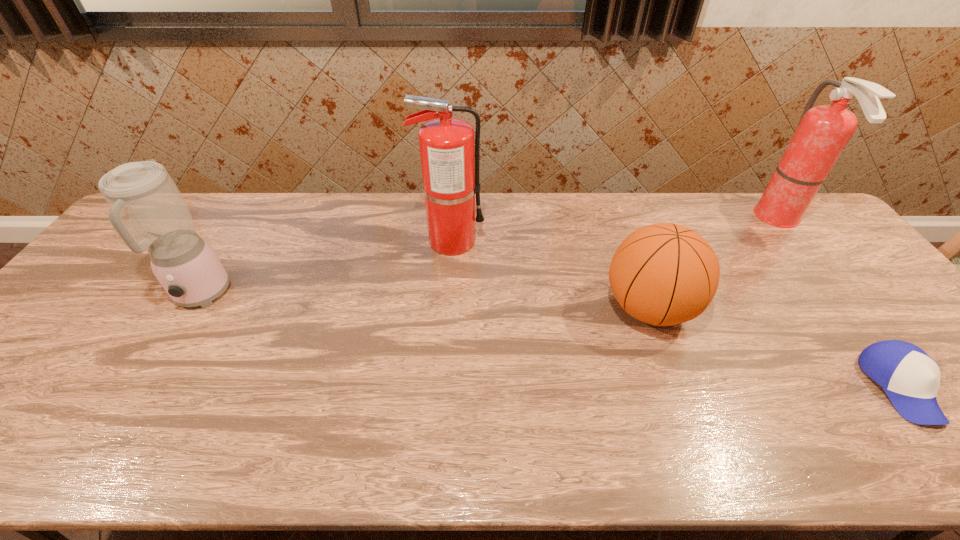
The height and width of the screenshot is (540, 960). What are the coordinates of `the second object from left to right` in the screenshot? It's located at click(450, 164).

You are a GUI agent. You are given a task and a screenshot of the screen. Output one action in this format:
    pyautogui.click(x=<x>, y=<y>)
    Task: Click on the right fire extinguisher
    
    Given the screenshot: What is the action you would take?
    click(x=823, y=132)

Locate an element on the screen. the leftmost object is located at coordinates (147, 210).

The height and width of the screenshot is (540, 960). Find the location of `food processor`. food processor is located at coordinates tap(147, 210).

Identify the location of the third object from right to left. The width and height of the screenshot is (960, 540). (664, 274).

What are the coordinates of `basketball` in the screenshot? It's located at (664, 274).

In order to click on free space located at the nozzle of the fourth object from right to left in this screenshot , I will do `click(609, 241)`.

I want to click on blank space located 0.090m with the handle and hose on the right fire extinguisher, so click(731, 219).

Locate an element on the screen. The width and height of the screenshot is (960, 540). vacant space positioned 0.170m with the handle and hose on the right fire extinguisher is located at coordinates (707, 219).

The image size is (960, 540). Identify the location of free space located with the handle and hose on the right fire extinguisher. coord(688,219).